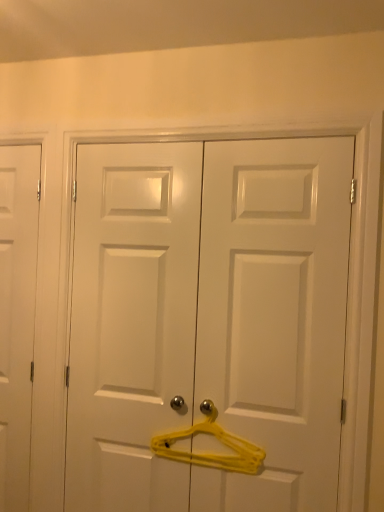
Image resolution: width=384 pixels, height=512 pixels. Describe the element at coordinates (208, 319) in the screenshot. I see `white glossy door at center, arranged as the 2th door when viewed from the left` at that location.

Locate an element on the screen. yellow plastic hanger at center is located at coordinates (209, 453).

Which is farther, (3, 188) or (239, 444)?

Positioned behind is point (3, 188).

From the image's perspective, is white matte door at left, which is the 2th door from right to left, beneath yellow plastic hanger at center?

No, from the image's perspective, white matte door at left, which is the 2th door from right to left, is not below yellow plastic hanger at center.

In the image, is white matte door at left, the first door when ordered from back to front, on the left side or the right side of yellow plastic hanger at center?

From the image, it's evident that white matte door at left, the first door when ordered from back to front, is to the left of yellow plastic hanger at center.

From the image's perspective, which object appears higher, yellow plastic hanger at center or white glossy door at center, placed as the 1th door when sorted from right to left?

From the image's view, white glossy door at center, placed as the 1th door when sorted from right to left, is above.

Considering the positions of point (213, 420) and point (338, 232), is point (213, 420) closer or farther from the camera than point (338, 232)?

Point (213, 420).

From a real-world perspective, count 2nd doors upward from the yellow plastic hanger at center and point to it. Please provide its 2D coordinates.

[(208, 319)]

Is yellow plastic hanger at center spatially inside white glossy door at center, placed as the 1th door when sorted from right to left, or outside of it?

yellow plastic hanger at center can be found inside white glossy door at center, placed as the 1th door when sorted from right to left.

Is yellow plastic hanger at center looking in the opposite direction of white matte door at left, which is the 2th door from front to back?

No, yellow plastic hanger at center is not facing away from white matte door at left, which is the 2th door from front to back.

Is yellow plastic hanger at center wider or thinner than white matte door at left, the first door when ordered from back to front?

Clearly, yellow plastic hanger at center has less width compared to white matte door at left, the first door when ordered from back to front.

Would you say yellow plastic hanger at center contains white matte door at left, the first door viewed from the left?

Actually, white matte door at left, the first door viewed from the left, is outside yellow plastic hanger at center.

Is white glossy door at center, marked as the 2th door in a back-to-front arrangement, bigger or smaller than yellow plastic hanger at center?

Considering their sizes, white glossy door at center, marked as the 2th door in a back-to-front arrangement, takes up more space than yellow plastic hanger at center.

Is white glossy door at center, marked as the 2th door in a back-to-front arrangement, in front of or behind yellow plastic hanger at center in the image?

white glossy door at center, marked as the 2th door in a back-to-front arrangement, is in front of yellow plastic hanger at center.

From the picture: Which is closer to the camera, (184, 150) or (245, 472)?

Point (184, 150) is farther from the camera than point (245, 472).

Consider the image. Who is shorter, white glossy door at center, placed as the 1th door when sorted from right to left, or white matte door at left, the first door when ordered from back to front?

Standing shorter between the two is white glossy door at center, placed as the 1th door when sorted from right to left.

Is white glossy door at center, marked as the 2th door in a back-to-front arrangement, not within white matte door at left, the first door viewed from the left?

Yes, white glossy door at center, marked as the 2th door in a back-to-front arrangement, is located beyond the bounds of white matte door at left, the first door viewed from the left.

Is white glossy door at center, the first door from the front, far away from white matte door at left, which is the 2th door from right to left?

No, there isn't a large distance between white glossy door at center, the first door from the front, and white matte door at left, which is the 2th door from right to left.

Locate an element on the screen. door on the right of white matte door at left, the first door when ordered from back to front is located at coordinates (208, 319).

Is white matte door at left, the first door viewed from the left, oriented away from white glossy door at center, marked as the 2th door in a back-to-front arrangement?

white matte door at left, the first door viewed from the left, is not turned away from white glossy door at center, marked as the 2th door in a back-to-front arrangement.

From a real-world perspective, which object stands above the other?

white glossy door at center, the first door from the front, from a real-world perspective.

Where is `hanger that is on the right side of white matte door at left, which is the 2th door from right to left`? The height and width of the screenshot is (512, 384). hanger that is on the right side of white matte door at left, which is the 2th door from right to left is located at coordinates (209, 453).

Where is `hanger behind the white glossy door at center, arranged as the 2th door when viewed from the left`? The width and height of the screenshot is (384, 512). hanger behind the white glossy door at center, arranged as the 2th door when viewed from the left is located at coordinates pyautogui.click(x=209, y=453).

When comparing their distances from white glossy door at center, marked as the 2th door in a back-to-front arrangement, does white matte door at left, the first door when ordered from back to front, or yellow plastic hanger at center seem closer?

yellow plastic hanger at center is closer to white glossy door at center, marked as the 2th door in a back-to-front arrangement.

From the image, which object appears to be farther from yellow plastic hanger at center, white glossy door at center, placed as the 1th door when sorted from right to left, or white matte door at left, which is the 2th door from right to left?

The object further to yellow plastic hanger at center is white matte door at left, which is the 2th door from right to left.

When comparing their distances from white glossy door at center, the first door from the front, does yellow plastic hanger at center or white matte door at left, which is the 2th door from right to left, seem closer?

yellow plastic hanger at center.

Which object lies nearer to the anchor point white matte door at left, which is the 2th door from right to left, white glossy door at center, arranged as the 2th door when viewed from the left, or yellow plastic hanger at center?

white glossy door at center, arranged as the 2th door when viewed from the left, is closer to white matte door at left, which is the 2th door from right to left.

When comparing their distances from yellow plastic hanger at center, does white matte door at left, which is the 2th door from right to left, or white glossy door at center, arranged as the 2th door when viewed from the left, seem closer?

white glossy door at center, arranged as the 2th door when viewed from the left.

Based on their spatial positions, is yellow plastic hanger at center or white glossy door at center, the first door from the front, closer to white matte door at left, which is the 2th door from right to left?

white glossy door at center, the first door from the front, is positioned closer to the anchor white matte door at left, which is the 2th door from right to left.

What are the coordinates of `door between white matte door at left, the first door when ordered from back to front, and yellow plastic hanger at center, in the horizontal direction` in the screenshot? It's located at (208, 319).